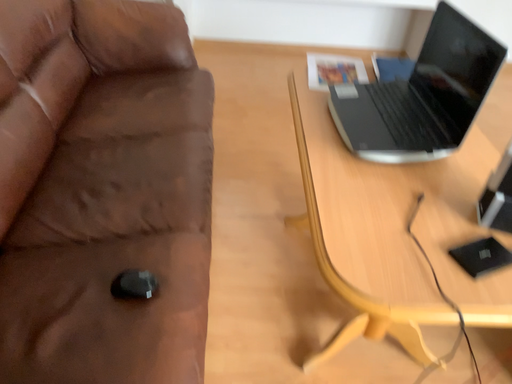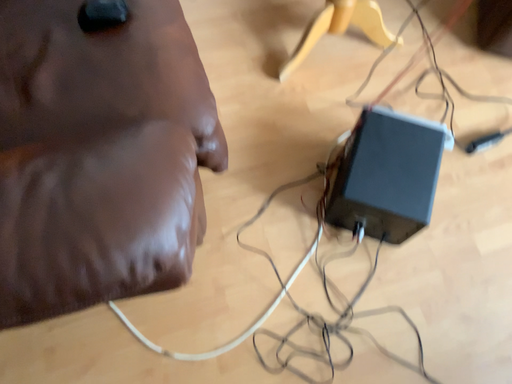
Question: How did the camera likely rotate when shooting the video?

Choices:
 (A) rotated downward
 (B) rotated upward

Answer: (A)